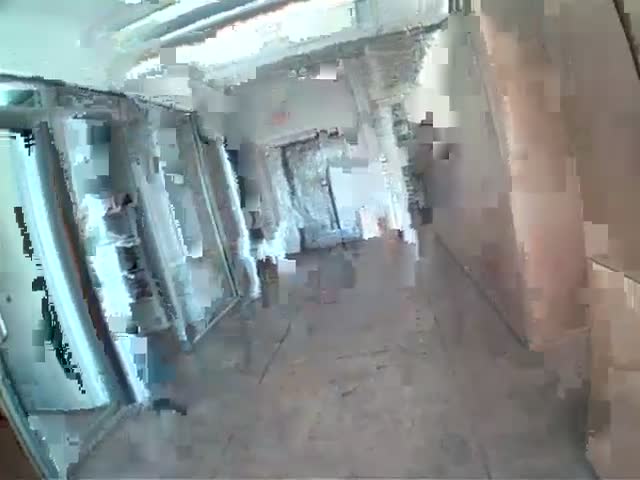
The width and height of the screenshot is (640, 480). Identify the location of brown/tan wall. (530, 219), (477, 152).